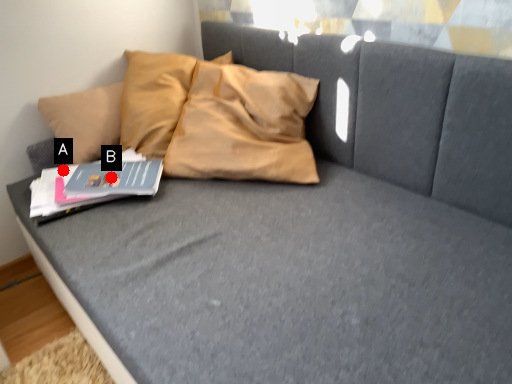
Question: Two points are circled on the image, labeled by A and B beside each circle. Which of the following is the closest to the observer?

Choices:
 (A) A is closer
 (B) B is closer

Answer: (B)